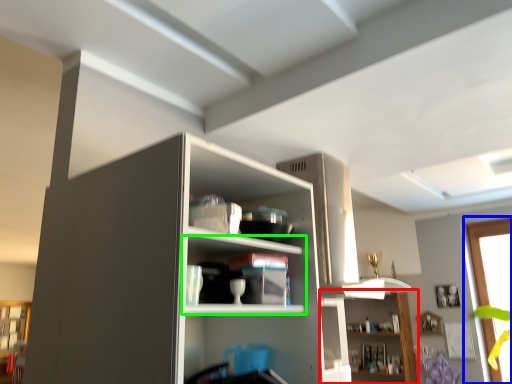
Question: Considering the real-world distances, which object is closest to shelf (highlighted by a red box)? window (highlighted by a blue box) or shelf (highlighted by a green box).

Choices:
 (A) window
 (B) shelf

Answer: (A)